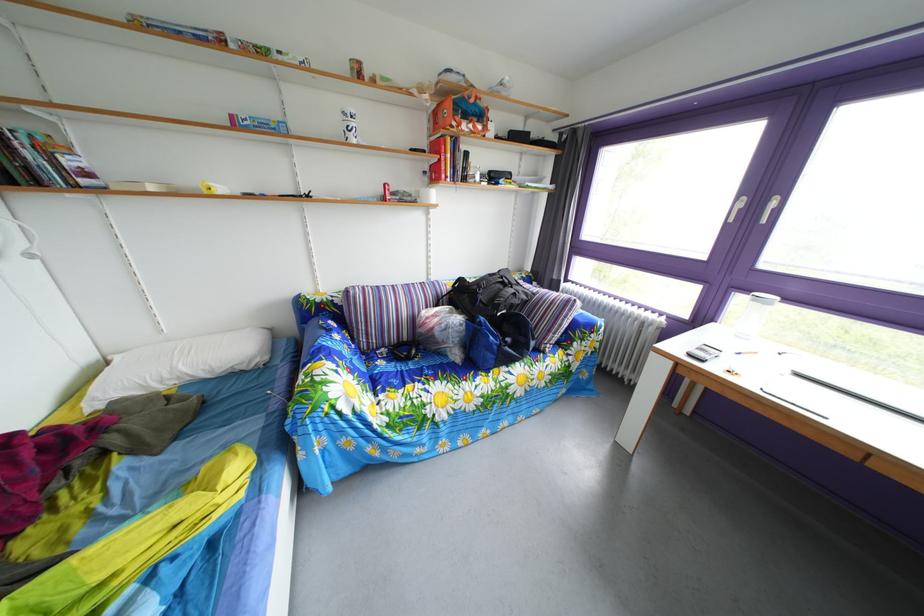
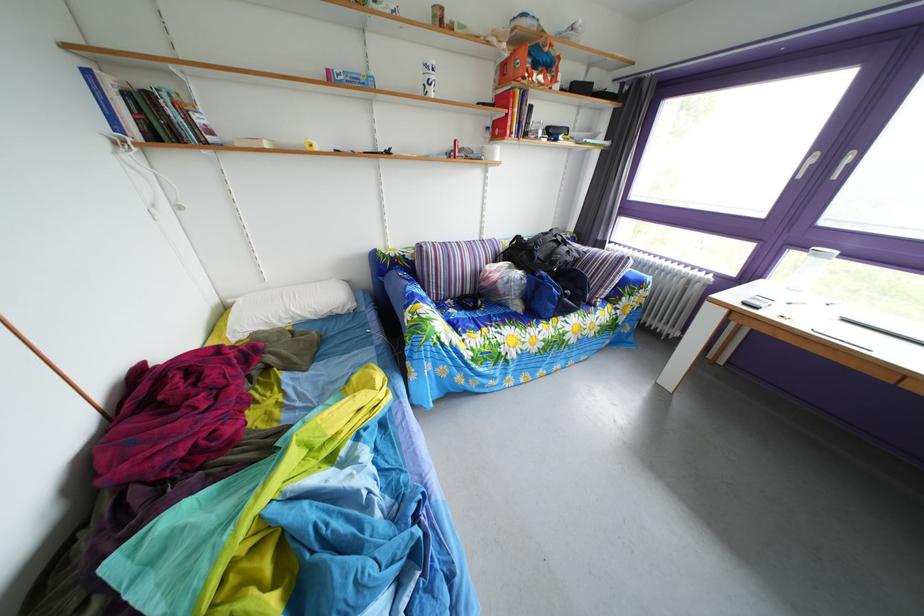
Find the pixel in the second image that matches the point at 242,124 in the first image.

(339, 79)